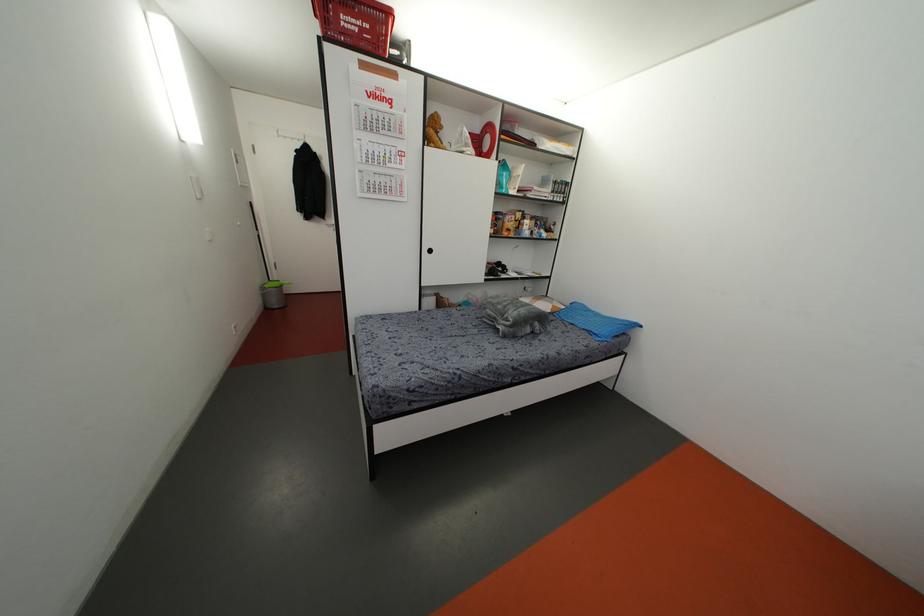
Find where to squeez the blue plastic bottle. Please return your answer as a coordinate pair (x, y).

(503, 177)